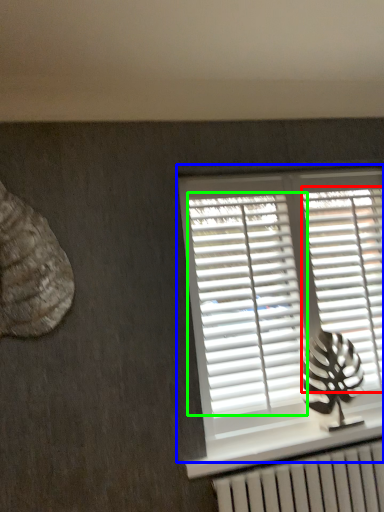
Question: Estimate the real-world distances between objects in this image. Which object is closer to shutter (highlighted by a red box), window (highlighted by a blue box) or shutter (highlighted by a green box)?

Choices:
 (A) window
 (B) shutter

Answer: (A)